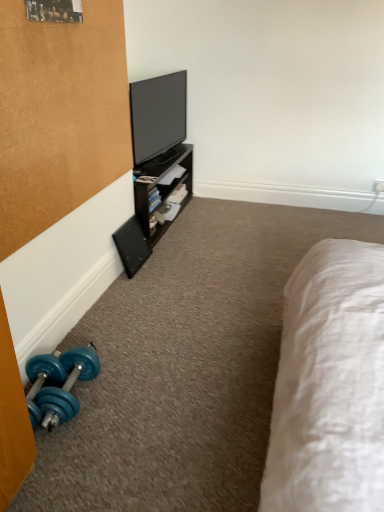
Question: In terms of width, does black matte speaker at lower left look wider or thinner when compared to flat screen tv at upper center?

Choices:
 (A) wide
 (B) thin

Answer: (B)

Question: From the image's perspective, is black matte speaker at lower left above or below flat screen tv at upper center?

Choices:
 (A) above
 (B) below

Answer: (B)

Question: Which object is positioned closest to the black matte speaker at lower left?

Choices:
 (A) flat screen tv at upper center
 (B) blue rubber dumbbell at lower left

Answer: (A)

Question: Which object is the farthest from the flat screen tv at upper center?

Choices:
 (A) blue rubber dumbbell at lower left
 (B) black matte speaker at lower left

Answer: (A)